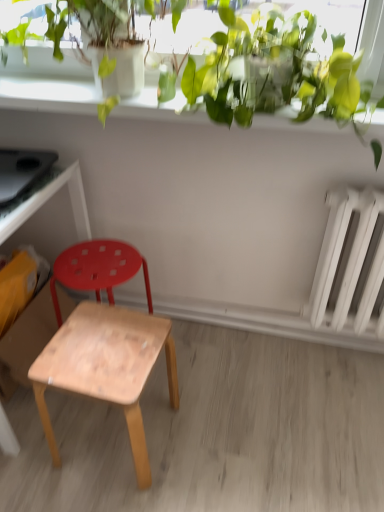
This screenshot has width=384, height=512. I want to click on green leafy plant at upper center, so click(x=282, y=71).

The height and width of the screenshot is (512, 384). Describe the element at coordinates (48, 199) in the screenshot. I see `wooden desk at left` at that location.

Identify the location of natural wood stool at center, which is the first stool in front-to-back order. Image resolution: width=384 pixels, height=512 pixels. (106, 367).

Identify the location of wooden stool at lower left, marked as the 1th stool in a back-to-front arrangement. (97, 269).

From a real-world perspective, is wooden stool at lower left, the 2th stool viewed from the front, located higher than white matte radiator at right?

Actually, wooden stool at lower left, the 2th stool viewed from the front, is physically below white matte radiator at right in the real world.

Is point (84, 264) positioned after point (378, 288)?

Yes.

Measure the distance between wooden stool at lower left, the 2th stool viewed from the front, and white matte radiator at right.

wooden stool at lower left, the 2th stool viewed from the front, and white matte radiator at right are 79.65 centimeters apart.

Between wooden stool at lower left, marked as the 1th stool in a back-to-front arrangement, and white matte radiator at right, which one has smaller size?

wooden stool at lower left, marked as the 1th stool in a back-to-front arrangement.

From the image's perspective, is green leafy plant at upper center on natural wood stool at center, which is the second stool in back-to-front order?

Yes, from the image's perspective, green leafy plant at upper center is over natural wood stool at center, which is the second stool in back-to-front order.

Consider the image. Is natural wood stool at center, which is the first stool in front-to-back order, located within green leafy plant at upper center?

That's incorrect, natural wood stool at center, which is the first stool in front-to-back order, is not inside green leafy plant at upper center.

The height and width of the screenshot is (512, 384). In order to click on the 1st stool behind the green leafy plant at upper center in this screenshot , I will do `click(106, 367)`.

What's the angular difference between wooden stool at lower left, marked as the 1th stool in a back-to-front arrangement, and wooden desk at left's facing directions?

They differ by 89.8 degrees in their facing directions.

Does wooden stool at lower left, marked as the 1th stool in a back-to-front arrangement, have a smaller size compared to wooden desk at left?

Correct, wooden stool at lower left, marked as the 1th stool in a back-to-front arrangement, occupies less space than wooden desk at left.

Is wooden desk at left completely or partially inside wooden stool at lower left, the 2th stool viewed from the front?

No, wooden desk at left is not surrounded by wooden stool at lower left, the 2th stool viewed from the front.

From a real-world perspective, which object rests below the other?

From a 3D spatial view, wooden stool at lower left, the 2th stool viewed from the front, is below.

Is wooden stool at lower left, the 2th stool viewed from the front, at the left side of green leafy plant at upper center?

Indeed, wooden stool at lower left, the 2th stool viewed from the front, is positioned on the left side of green leafy plant at upper center.

From a real-world perspective, is wooden stool at lower left, the 2th stool viewed from the front, under green leafy plant at upper center?

Yes, from a real-world perspective, wooden stool at lower left, the 2th stool viewed from the front, is below green leafy plant at upper center.

Is wooden stool at lower left, marked as the 1th stool in a back-to-front arrangement, facing away from green leafy plant at upper center?

No.

Would you consider wooden desk at left to be distant from green leafy plant at upper center?

No, wooden desk at left is not far away from green leafy plant at upper center.

From the image's perspective, which object appears higher, wooden desk at left or green leafy plant at upper center?

From the image's view, green leafy plant at upper center is above.

Between wooden desk at left and green leafy plant at upper center, which one has smaller width?

Thinner between the two is green leafy plant at upper center.

How many degrees apart are the facing directions of wooden desk at left and green leafy plant at upper center?

They differ by 0.502 degrees in their facing directions.

Is green leafy plant at upper center closer to the viewer compared to wooden desk at left?

Yes, the depth of green leafy plant at upper center is less than that of wooden desk at left.

Between green leafy plant at upper center and wooden desk at left, which one has smaller size?

green leafy plant at upper center is smaller.

In terms of width, does green leafy plant at upper center look wider or thinner when compared to wooden desk at left?

green leafy plant at upper center is thinner than wooden desk at left.

From a real-world perspective, is green leafy plant at upper center positioned above or below wooden desk at left?

In terms of real-world spatial position, green leafy plant at upper center is above wooden desk at left.

Is natural wood stool at center, which is the second stool in back-to-front order, in front of or behind wooden stool at lower left, marked as the 1th stool in a back-to-front arrangement, in the image?

Visually, natural wood stool at center, which is the second stool in back-to-front order, is located in front of wooden stool at lower left, marked as the 1th stool in a back-to-front arrangement.

Could wooden stool at lower left, the 2th stool viewed from the front, be considered to be inside natural wood stool at center, which is the first stool in front-to-back order?

No, wooden stool at lower left, the 2th stool viewed from the front, is not surrounded by natural wood stool at center, which is the first stool in front-to-back order.

From the image's perspective, which object appears higher, natural wood stool at center, which is the first stool in front-to-back order, or wooden stool at lower left, marked as the 1th stool in a back-to-front arrangement?

From the image's view, wooden stool at lower left, marked as the 1th stool in a back-to-front arrangement, is above.

Identify the location of radiator above the wooden stool at lower left, the 2th stool viewed from the front (from a real-world perspective). The width and height of the screenshot is (384, 512). (350, 263).

At what (x,y) coordinates should I click in order to perform the action: click on the 1st stool behind the green leafy plant at upper center, starting your count from the anchor. Please return your answer as a coordinate pair (x, y). Looking at the image, I should click on (106, 367).

Looking at the image, which one is located closer to wooden stool at lower left, the 2th stool viewed from the front, wooden desk at left or green leafy plant at upper center?

The object closer to wooden stool at lower left, the 2th stool viewed from the front, is wooden desk at left.

Looking at the image, which one is located closer to wooden desk at left, wooden stool at lower left, the 2th stool viewed from the front, or white matte radiator at right?

Based on the image, wooden stool at lower left, the 2th stool viewed from the front, appears to be nearer to wooden desk at left.

Considering their positions, is green leafy plant at upper center positioned closer to wooden stool at lower left, the 2th stool viewed from the front, than natural wood stool at center, which is the second stool in back-to-front order?

The object closer to wooden stool at lower left, the 2th stool viewed from the front, is natural wood stool at center, which is the second stool in back-to-front order.

Estimate the real-world distances between objects in this image. Which object is closer to white matte radiator at right, natural wood stool at center, which is the second stool in back-to-front order, or wooden stool at lower left, the 2th stool viewed from the front?

Among the two, natural wood stool at center, which is the second stool in back-to-front order, is located nearer to white matte radiator at right.

Based on the photo, which object lies further to the anchor point natural wood stool at center, which is the second stool in back-to-front order, white matte radiator at right or wooden stool at lower left, marked as the 1th stool in a back-to-front arrangement?

Among the two, white matte radiator at right is located further to natural wood stool at center, which is the second stool in back-to-front order.

From the image, which object appears to be nearer to wooden stool at lower left, marked as the 1th stool in a back-to-front arrangement, wooden desk at left or natural wood stool at center, which is the first stool in front-to-back order?

wooden desk at left is positioned closer to the anchor wooden stool at lower left, marked as the 1th stool in a back-to-front arrangement.

Estimate the real-world distances between objects in this image. Which object is further from natural wood stool at center, which is the second stool in back-to-front order, wooden desk at left or green leafy plant at upper center?

green leafy plant at upper center is further to natural wood stool at center, which is the second stool in back-to-front order.

Estimate the real-world distances between objects in this image. Which object is further from natural wood stool at center, which is the second stool in back-to-front order, green leafy plant at upper center or wooden desk at left?

Based on the image, green leafy plant at upper center appears to be further to natural wood stool at center, which is the second stool in back-to-front order.

At what (x,y) coordinates should I click in order to perform the action: click on radiator between green leafy plant at upper center and natural wood stool at center, which is the second stool in back-to-front order, in the vertical direction. Please return your answer as a coordinate pair (x, y). The width and height of the screenshot is (384, 512). Looking at the image, I should click on (350, 263).

You are a GUI agent. You are given a task and a screenshot of the screen. Output one action in this format:
    pyautogui.click(x=<x>, y=<y>)
    Task: Click on the stool located between wooden desk at left and natural wood stool at center, which is the first stool in front-to-back order, in the left-right direction
    This screenshot has width=384, height=512.
    Given the screenshot: What is the action you would take?
    pyautogui.click(x=97, y=269)

Locate an element on the screen. vegetation between wooden desk at left and white matte radiator at right in the horizontal direction is located at coordinates (282, 71).

You are a GUI agent. You are given a task and a screenshot of the screen. Output one action in this format:
    pyautogui.click(x=<x>, y=<y>)
    Task: Click on the stool between wooden stool at lower left, marked as the 1th stool in a back-to-front arrangement, and white matte radiator at right
    This screenshot has width=384, height=512.
    Given the screenshot: What is the action you would take?
    pyautogui.click(x=106, y=367)